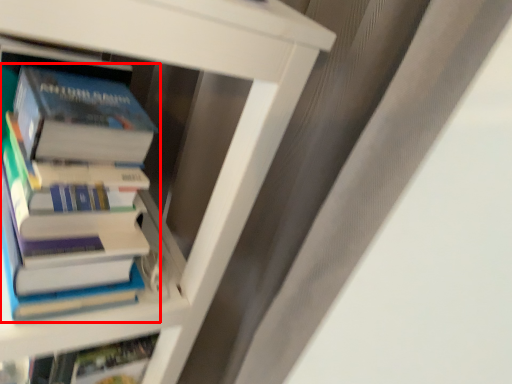
Question: From the image's perspective, what is the correct spatial relationship of book (annotated by the red box) in relation to book?

Choices:
 (A) below
 (B) above

Answer: (B)